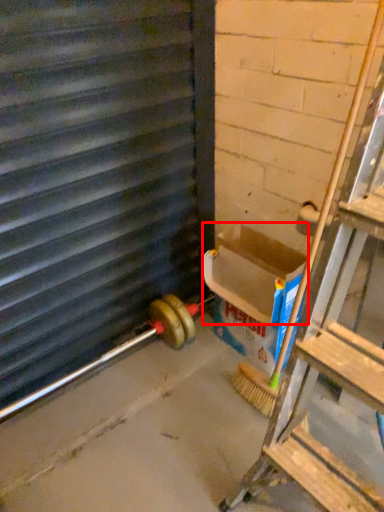
Question: From the image's perspective, what is the correct spatial positioning of box (annotated by the red box) in reference to window frame?

Choices:
 (A) above
 (B) below

Answer: (B)